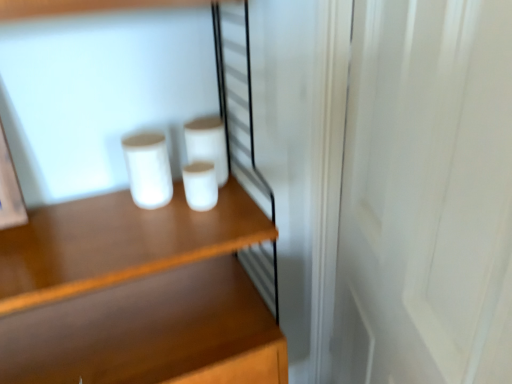
Question: Does point (195, 210) appear closer or farther from the camera than point (162, 157)?

Choices:
 (A) farther
 (B) closer

Answer: (A)

Question: Which is correct: white matte cup at center, which appears as the 3th paper towel when viewed from the left, is inside white matte cup at center, the 3th paper towel positioned from the right, or outside of it?

Choices:
 (A) outside
 (B) inside

Answer: (A)

Question: Based on their relative distances, which object is nearer to the white wood screen door at right?

Choices:
 (A) wooden shelf at center
 (B) white matte cup at center, arranged as the 1th paper towel when viewed from the right
 (C) white matte paper towel at center, positioned as the 2th paper towel in right-to-left order
 (D) white matte cup at center, acting as the 1th paper towel starting from the left

Answer: (C)

Question: Estimate the real-world distances between objects in this image. Which object is closer to the white wood screen door at right?

Choices:
 (A) white matte cup at center, the 3th paper towel positioned from the right
 (B) white matte cup at center, arranged as the 1th paper towel when viewed from the right
 (C) white matte paper towel at center, positioned as the 2th paper towel in right-to-left order
 (D) wooden shelf at center

Answer: (C)